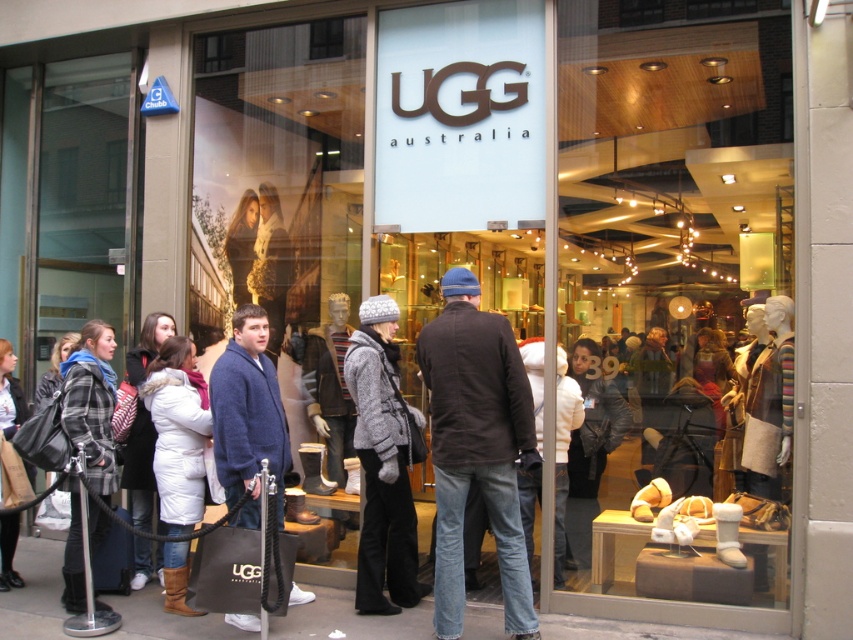
Who is taller, matte black boots at center or white down jacket at center?

Standing taller between the two is matte black boots at center.

Is point (314, 145) closer to viewer compared to point (200, 476)?

No, it is behind (200, 476).

The image size is (853, 640). Find the location of `matte black boots at center`. matte black boots at center is located at coordinates (281, 200).

Is blue wool sweater at center wider than plaid wool coat at left?

Correct, the width of blue wool sweater at center exceeds that of plaid wool coat at left.

Does blue wool sweater at center lie in front of plaid wool coat at left?

Yes, blue wool sweater at center is in front of plaid wool coat at left.

Who is more distant from viewer, (265, 435) or (71, 387)?

Positioned behind is point (71, 387).

Where is `blue wool sweater at center`? The height and width of the screenshot is (640, 853). blue wool sweater at center is located at coordinates (248, 410).

Does knitted gray sweater at center have a lesser width compared to blue wool sweater at center?

No, knitted gray sweater at center is not thinner than blue wool sweater at center.

What do you see at coordinates (381, 464) in the screenshot?
I see `knitted gray sweater at center` at bounding box center [381, 464].

Find the location of a particular element. knitted gray sweater at center is located at coordinates (381, 464).